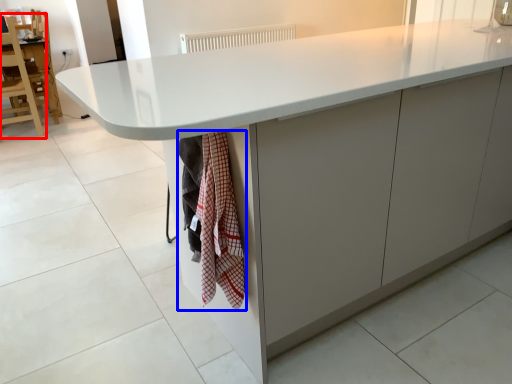
Question: Among these objects, which one is nearest to the camera, chair (highlighted by a red box) or blanket (highlighted by a blue box)?

Choices:
 (A) chair
 (B) blanket

Answer: (B)